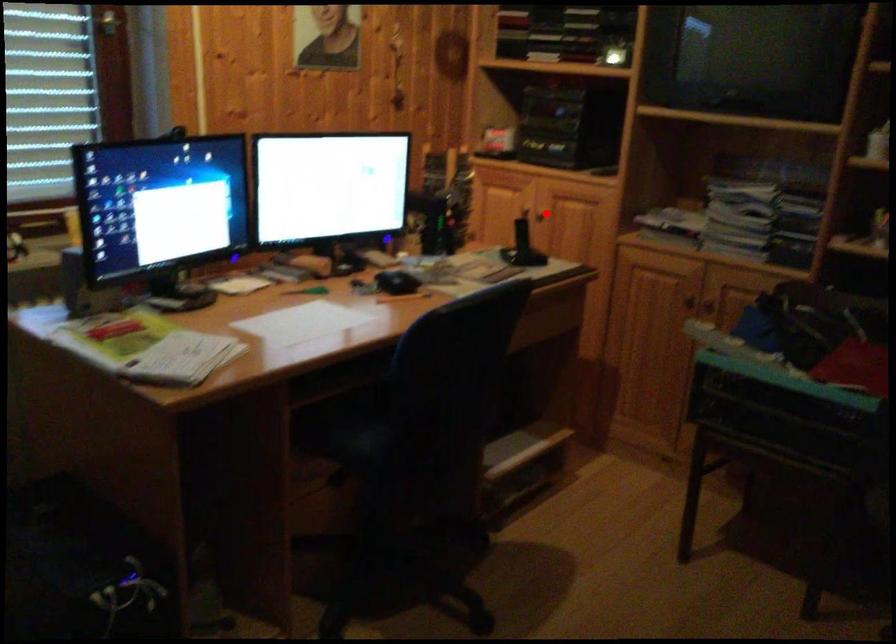
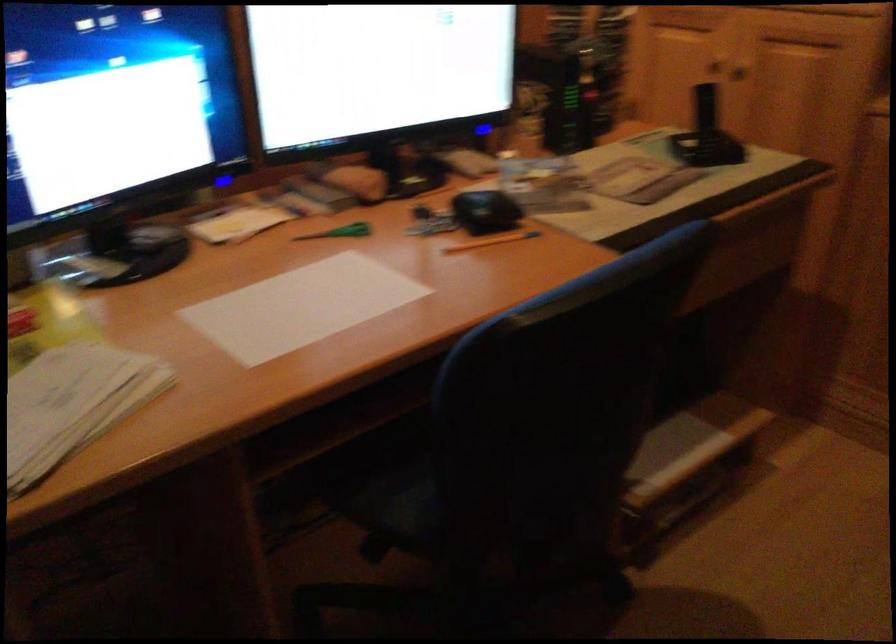
Question: I am providing you with two images of the same scene from different viewpoints. A red point is shown in image1. For the corresponding object point in image2, is it positioned nearer or farther from the camera?

Choices:
 (A) Nearer
 (B) Farther

Answer: (A)